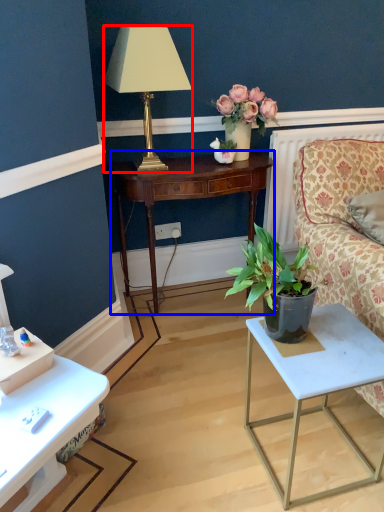
Question: Which object appears closest to the camera in this image, lamp (highlighted by a red box) or nightstand (highlighted by a blue box)?

Choices:
 (A) lamp
 (B) nightstand

Answer: (A)